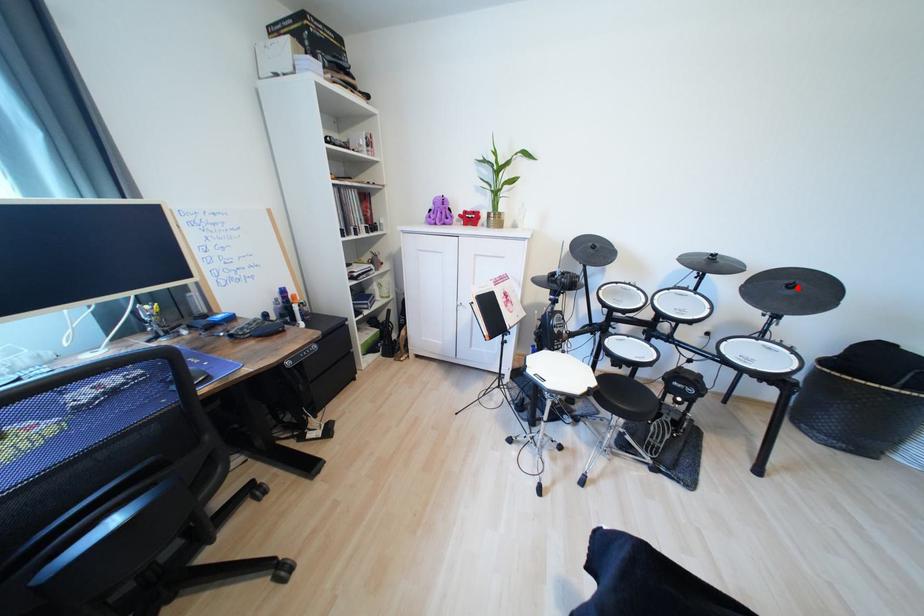
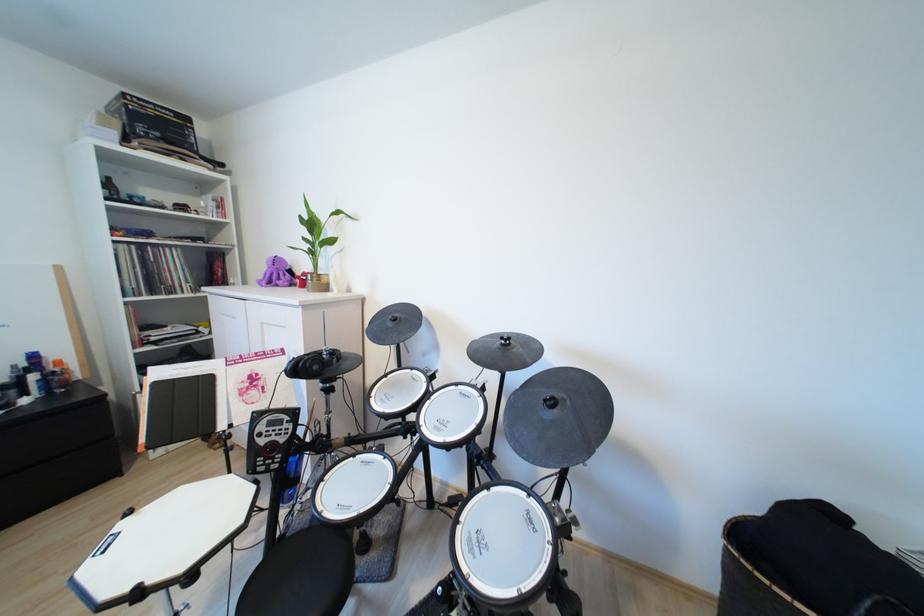
The point at the highlighted location is marked in the first image. Where is the corresponding point in the second image?

(560, 405)